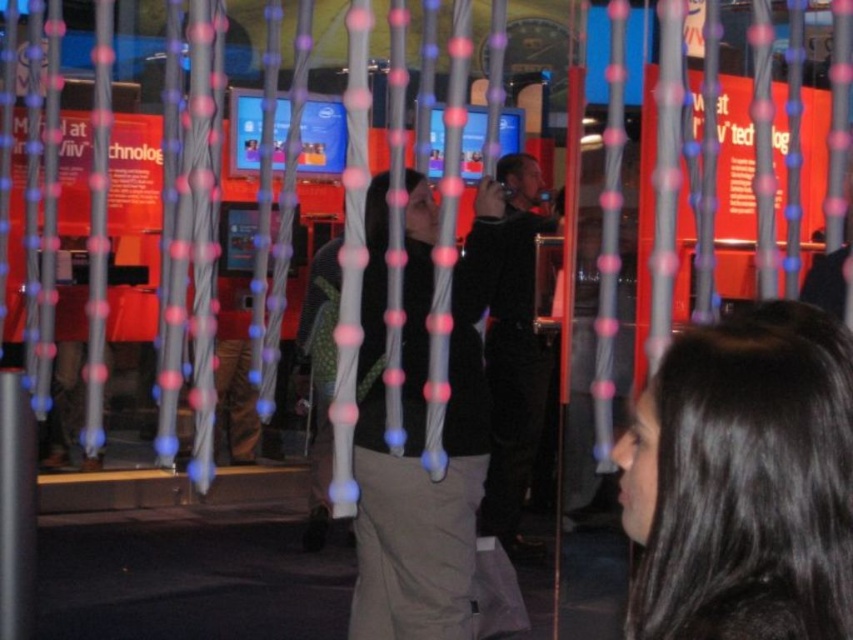
You are a photographer trying to capture a clear shot of the black hair at upper right and the dark blue fabric jacket at center. Since you want both subjects in focus, which one should you adjust your camera focus closer to?

The black hair at upper right is shorter than the dark blue fabric jacket at center. To ensure both are in focus, you should adjust your camera focus closer to the black hair at upper right because it is closer to the camera.

You are a photographer trying to capture a candid shot of both the black hair at upper right and the dark blue fabric jacket at center without moving your camera position. Based on their positions, which subject is closer to the left edge of your frame?

The dark blue fabric jacket at center is closer to the left edge of your frame because the black hair at upper right is positioned to the right of it.